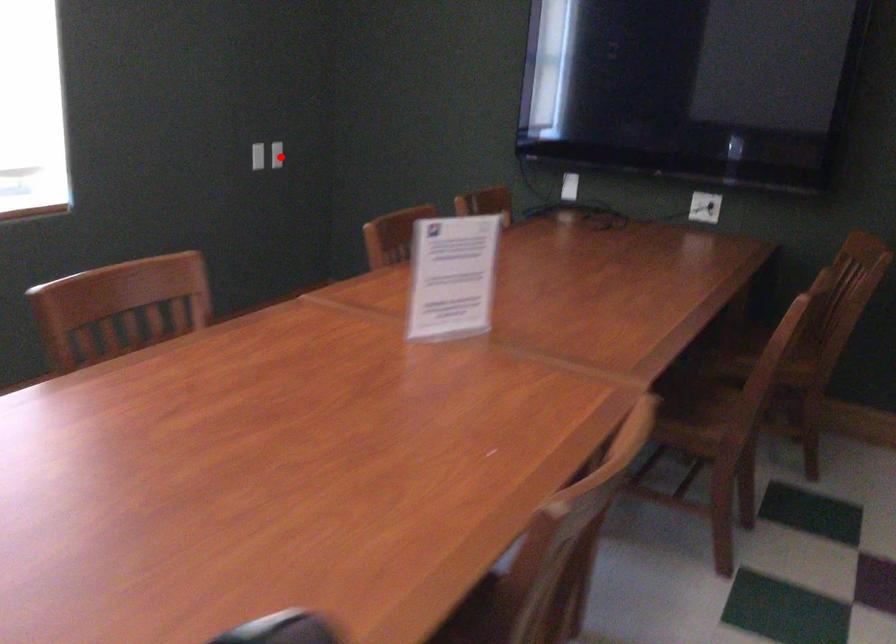
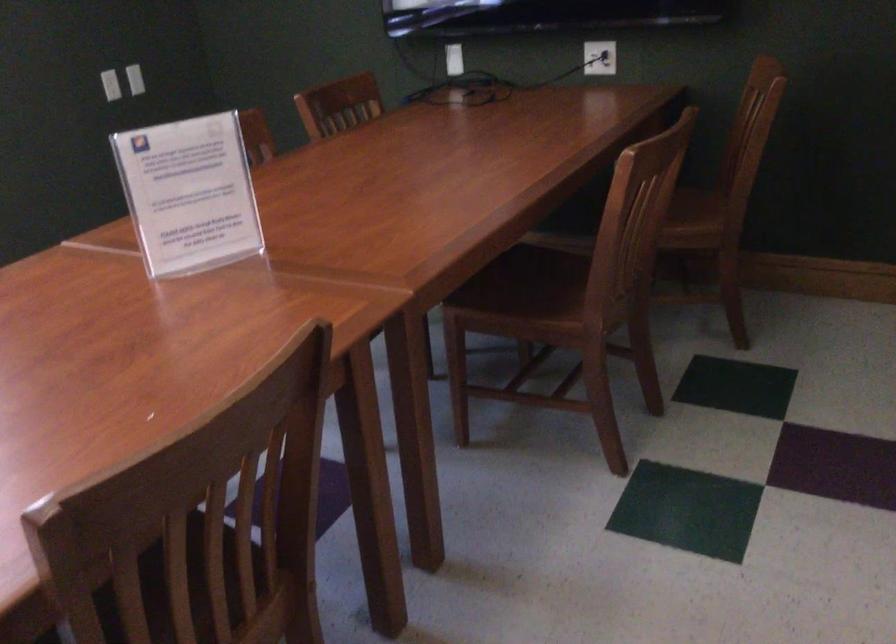
Question: I am providing you with two images of the same scene from different viewpoints. In image1, a red point is highlighted. Considering the same 3D point in image2, which of the following is correct?

Choices:
 (A) It is closer
 (B) It is farther

Answer: (A)